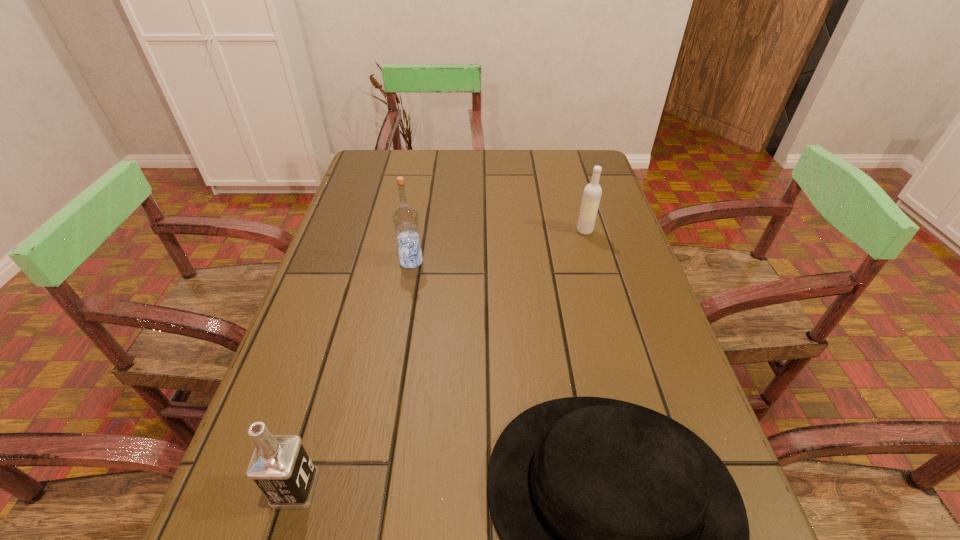
Image resolution: width=960 pixels, height=540 pixels. I want to click on the third object from right to left, so [x=405, y=217].

Identify the location of the tallest object. (405, 217).

Where is `the farthest object`? The height and width of the screenshot is (540, 960). the farthest object is located at coordinates (592, 193).

This screenshot has width=960, height=540. In order to click on the rightmost vodka in this screenshot , I will do `click(592, 193)`.

Identify the location of the nearest vodka. The height and width of the screenshot is (540, 960). (281, 468).

Where is `the leftmost vodka`? the leftmost vodka is located at coordinates (281, 468).

The width and height of the screenshot is (960, 540). Find the location of `free space located 0.100m on the back of the tallest object`. free space located 0.100m on the back of the tallest object is located at coordinates (417, 230).

Locate an element on the screen. The image size is (960, 540). vacant space situated 0.380m on the left of the farthest vodka is located at coordinates (435, 231).

You are a GUI agent. You are given a task and a screenshot of the screen. Output one action in this format:
    pyautogui.click(x=<x>, y=<y>)
    Task: Click on the free region located on the front label of the leftmost object
    The height and width of the screenshot is (540, 960).
    Given the screenshot: What is the action you would take?
    pyautogui.click(x=448, y=489)

Locate an element on the screen. The width and height of the screenshot is (960, 540). object located in the left edge section of the desktop is located at coordinates (281, 468).